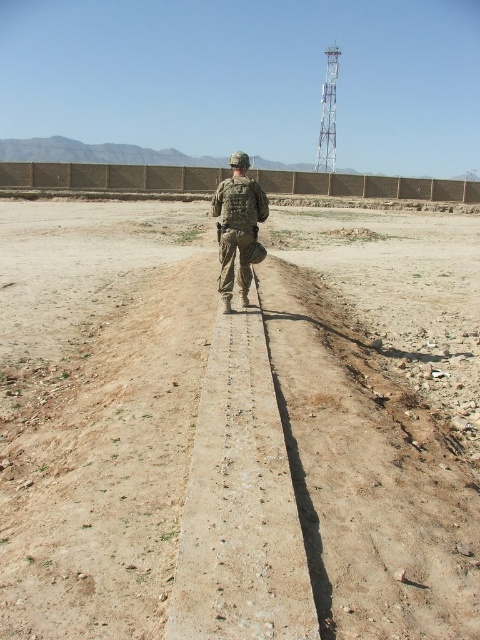
Can you confirm if dusty brown dirt at center is taller than camouflage fabric uniform at center?

No.

Measure the distance between dusty brown dirt at center and camera.

dusty brown dirt at center is 2.41 meters away from camera.

You are a GUI agent. You are given a task and a screenshot of the screen. Output one action in this format:
    pyautogui.click(x=<x>, y=<y>)
    Task: Click on the dusty brown dirt at center
    This screenshot has width=480, height=640.
    Given the screenshot: What is the action you would take?
    pyautogui.click(x=233, y=426)